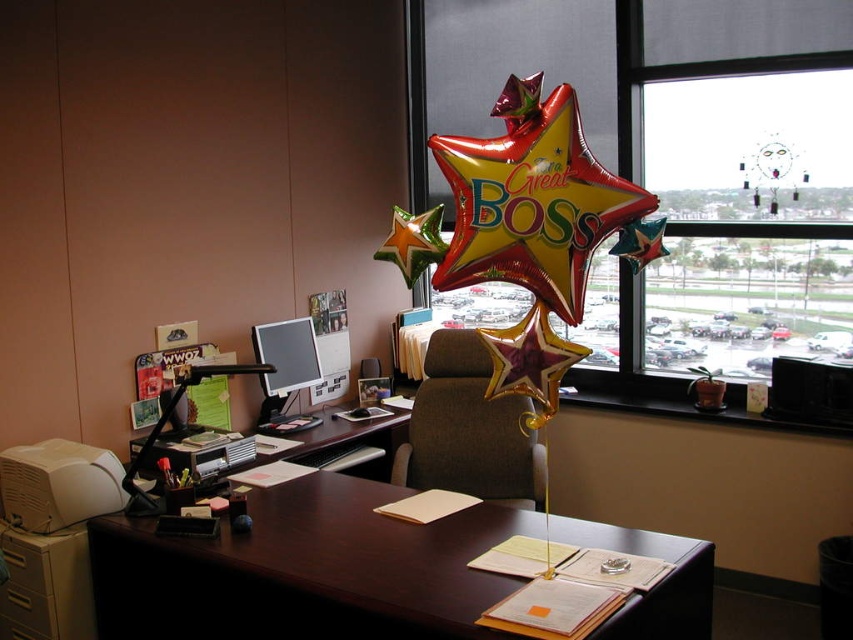
From the picture: Can you confirm if dark wood desk at center is positioned above matte black monitor at center?

No.

Is dark wood desk at center shorter than matte black monitor at center?

Yes.

This screenshot has width=853, height=640. What do you see at coordinates (305, 570) in the screenshot?
I see `dark wood desk at center` at bounding box center [305, 570].

In order to click on dark wood desk at center in this screenshot , I will do point(305,570).

Who is positioned more to the right, dark wood desk at center or matte brown swivel chair at center?

matte brown swivel chair at center

Identify the location of dark wood desk at center. (305, 570).

Describe the element at coordinates (305, 570) in the screenshot. The height and width of the screenshot is (640, 853). I see `dark wood desk at center` at that location.

At what (x,y) coordinates should I click in order to perform the action: click on dark wood desk at center. Please return your answer as a coordinate pair (x, y). Image resolution: width=853 pixels, height=640 pixels. Looking at the image, I should click on (305, 570).

Who is taller, dark wood desk at center or brown wood computer desk at center?

dark wood desk at center

Based on the photo, can you confirm if dark wood desk at center is wider than brown wood computer desk at center?

Indeed, dark wood desk at center has a greater width compared to brown wood computer desk at center.

What do you see at coordinates (305, 570) in the screenshot? This screenshot has width=853, height=640. I see `dark wood desk at center` at bounding box center [305, 570].

Identify the location of dark wood desk at center. (305, 570).